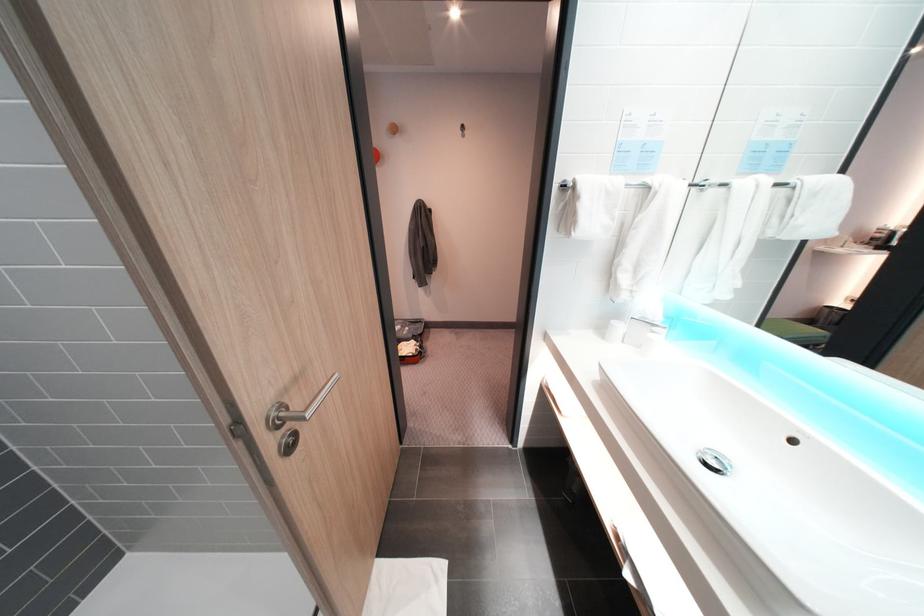
What do you see at coordinates (463, 130) in the screenshot?
I see `the small wall hook` at bounding box center [463, 130].